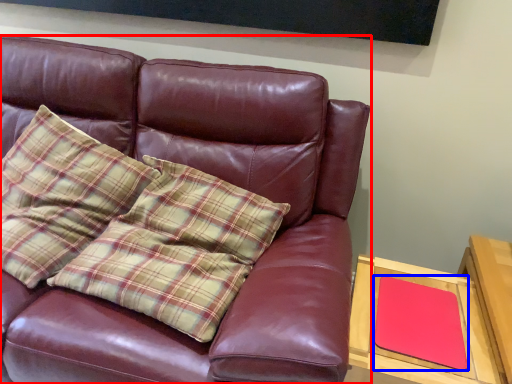
Question: Which of the following is the closest to the observer, studio couch (highlighted by a red box) or pad (highlighted by a blue box)?

Choices:
 (A) studio couch
 (B) pad

Answer: (A)